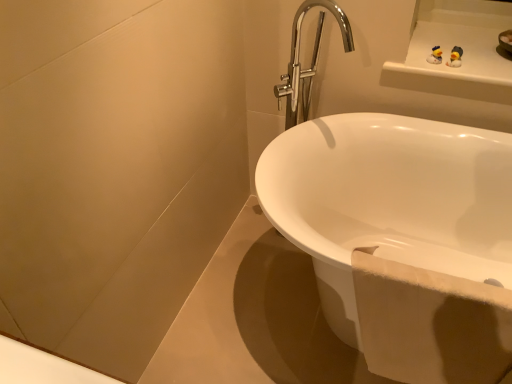
Describe the element at coordinates (389, 200) in the screenshot. I see `white glossy bathtub at center` at that location.

Image resolution: width=512 pixels, height=384 pixels. I want to click on white glossy bathtub at center, so click(389, 200).

Identify the location of white glossy bathtub at center. (389, 200).